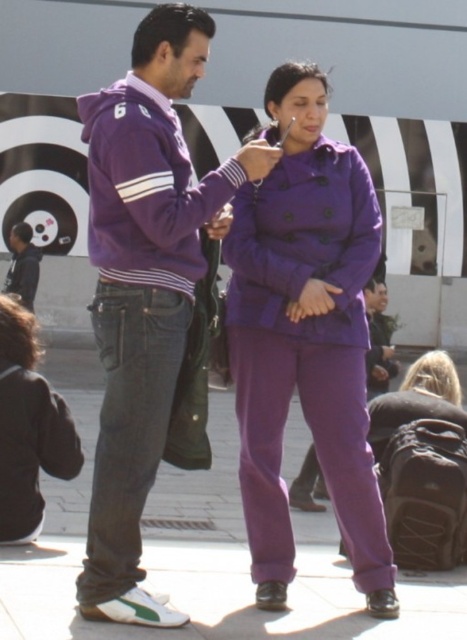
Which is more to the left, purple matte jacket at center or matte purple sweatshirt at left?

From the viewer's perspective, matte purple sweatshirt at left appears more on the left side.

What do you see at coordinates (304, 244) in the screenshot?
I see `purple matte jacket at center` at bounding box center [304, 244].

Image resolution: width=467 pixels, height=640 pixels. In order to click on purple matte jacket at center in this screenshot , I will do `click(304, 244)`.

Is purple woolen coat at center positioned in front of purple fabric pants at center?

That is False.

Does point (269, 305) come behind point (250, 636)?

Yes, point (269, 305) is farther from viewer.

Where is `purple woolen coat at center`? This screenshot has width=467, height=640. purple woolen coat at center is located at coordinates (304, 337).

Does purple cotton hoodie at left appear on the left side of purple fabric pants at center?

Yes, purple cotton hoodie at left is to the left of purple fabric pants at center.

Is point (111, 150) positioned in front of point (20, 630)?

No, (111, 150) is behind (20, 630).

Locate an element on the screen. The image size is (467, 640). purple cotton hoodie at left is located at coordinates (144, 285).